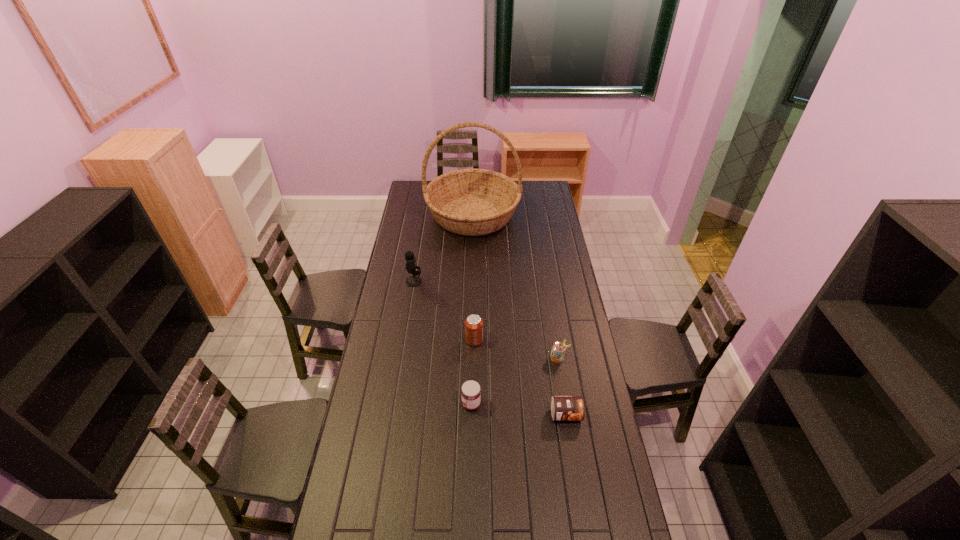
What are the coordinates of `the nearest can` in the screenshot? It's located at 563,408.

Locate an element on the screen. Image resolution: width=960 pixels, height=540 pixels. free location located 0.280m on the front of the tallest object is located at coordinates (471, 278).

The width and height of the screenshot is (960, 540). I want to click on free point located on the front of the fifth shortest object, so click(x=408, y=315).

At what (x,y) coordinates should I click in order to perform the action: click on free spot located on the front of the farthest can. Please return your answer as a coordinate pair (x, y). Image resolution: width=960 pixels, height=540 pixels. Looking at the image, I should click on (473, 393).

Where is `blank space located 0.400m on the left of the second tallest can`? The image size is (960, 540). blank space located 0.400m on the left of the second tallest can is located at coordinates (453, 357).

This screenshot has width=960, height=540. I want to click on vacant space located 0.290m on the back of the jam, so click(x=472, y=338).

Where is `vacant space located on the front label of the shortest object`? vacant space located on the front label of the shortest object is located at coordinates (580, 502).

Locate an element on the screen. The width and height of the screenshot is (960, 540). object located in the far edge section of the desktop is located at coordinates (471, 202).

Where is `basket positioned at the left edge`? The height and width of the screenshot is (540, 960). basket positioned at the left edge is located at coordinates (471, 202).

Identify the location of microphone that is at the left edge. [x=412, y=281].